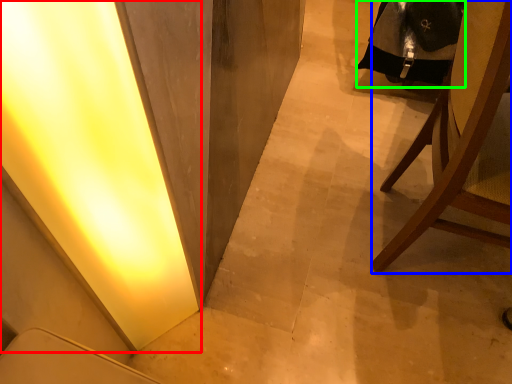
Question: Estimate the real-world distances between objects in this image. Which object is closer to light (highlighted by a red box), chair (highlighted by a blue box) or robe (highlighted by a green box)?

Choices:
 (A) chair
 (B) robe

Answer: (A)